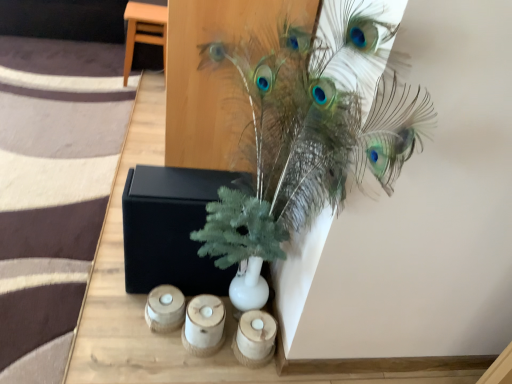
Question: Based on their sizes in the image, would you say black matte box at center is bigger or smaller than wooden candle holder at lower center, positioned as the first candle holder in left-to-right order?

Choices:
 (A) small
 (B) big

Answer: (B)

Question: From a real-world perspective, relative to wooden candle holder at lower center, positioned as the first candle holder in left-to-right order, is black matte box at center vertically above or below?

Choices:
 (A) above
 (B) below

Answer: (A)

Question: Estimate the real-world distances between objects in this image. Which object is closer to the wooden candle holder at lower center, which is the second candle holder from right to left?

Choices:
 (A) black matte box at center
 (B) light brown wood stool at upper left
 (C) green matte plant at upper center
 (D) wooden candle holder at lower center, placed as the 1th candle holder when sorted from right to left
 (E) wooden candle holder at lower center, which is the third candle holder from right to left

Answer: (E)

Question: Which of these objects is positioned closest to the wooden candle holder at lower center, the 2th candle holder viewed from the left?

Choices:
 (A) wooden candle holder at lower center, which is the 3th candle holder in left-to-right order
 (B) light brown wood stool at upper left
 (C) wooden candle holder at lower center, positioned as the first candle holder in left-to-right order
 (D) black matte box at center
 (E) green matte plant at upper center

Answer: (C)